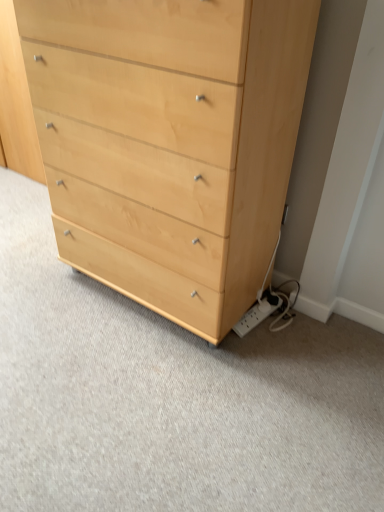
Question: Is white plastic power strip at lower right surrounded by light wood chest of drawers at center?

Choices:
 (A) yes
 (B) no

Answer: (B)

Question: Does light wood chest of drawers at center have a larger size compared to white plastic power strip at lower right?

Choices:
 (A) no
 (B) yes

Answer: (B)

Question: From a real-world perspective, is light wood chest of drawers at center positioned under white plastic power strip at lower right based on gravity?

Choices:
 (A) no
 (B) yes

Answer: (A)

Question: Can you confirm if light wood chest of drawers at center is positioned to the right of white plastic power strip at lower right?

Choices:
 (A) no
 (B) yes

Answer: (A)

Question: Is light wood chest of drawers at center next to white plastic power strip at lower right and touching it?

Choices:
 (A) yes
 (B) no

Answer: (B)

Question: From the image's perspective, is light wood chest of drawers at center located above white plastic power strip at lower right?

Choices:
 (A) yes
 (B) no

Answer: (A)

Question: Does white plastic power strip at lower right have a greater height compared to light wood chest of drawers at center?

Choices:
 (A) no
 (B) yes

Answer: (A)

Question: Is white plastic power strip at lower right positioned beyond the bounds of light wood chest of drawers at center?

Choices:
 (A) yes
 (B) no

Answer: (A)

Question: Is white plastic power strip at lower right facing towards light wood chest of drawers at center?

Choices:
 (A) yes
 (B) no

Answer: (A)

Question: Is white plastic power strip at lower right behind light wood chest of drawers at center?

Choices:
 (A) no
 (B) yes

Answer: (B)

Question: Can you confirm if white plastic power strip at lower right is thinner than light wood chest of drawers at center?

Choices:
 (A) yes
 (B) no

Answer: (A)

Question: Considering the relative positions of white plastic power strip at lower right and light wood chest of drawers at center in the image provided, is white plastic power strip at lower right to the left of light wood chest of drawers at center from the viewer's perspective?

Choices:
 (A) yes
 (B) no

Answer: (B)

Question: From the image's perspective, relative to light wood chest of drawers at center, is white plastic power strip at lower right above or below?

Choices:
 (A) above
 (B) below

Answer: (B)